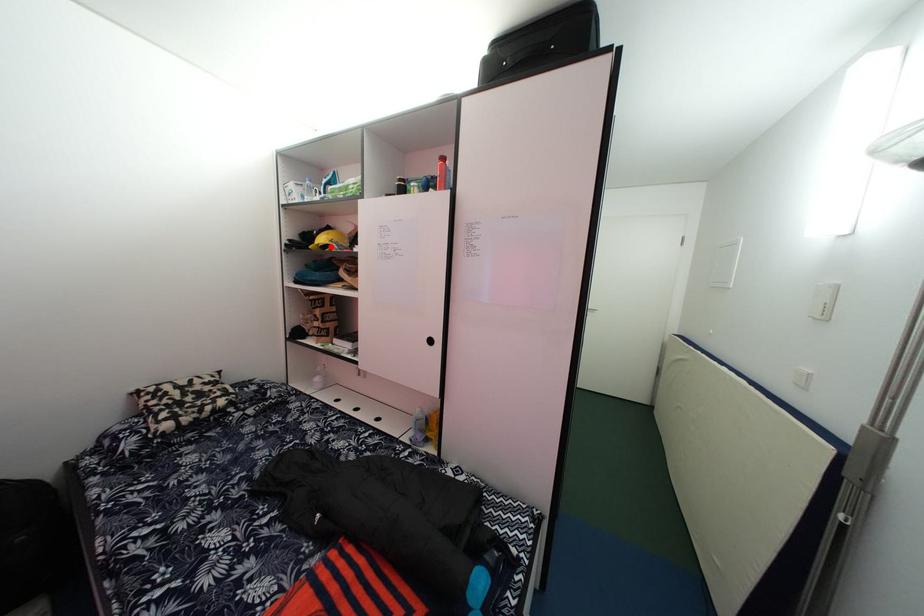
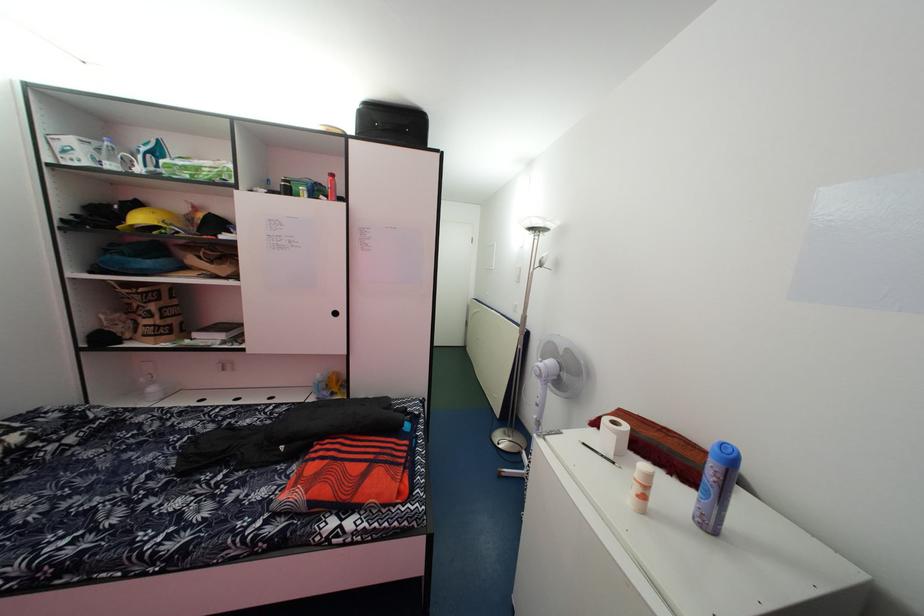
Find the pixel in the second image that matches the highlighted location in the first image.

(149, 225)